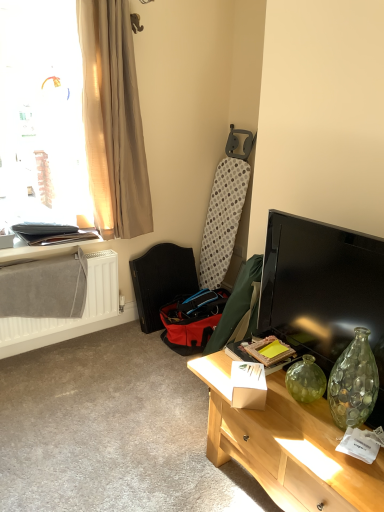
The image size is (384, 512). I want to click on blank space above white cardboard box at center (from a real-world perspective), so click(254, 370).